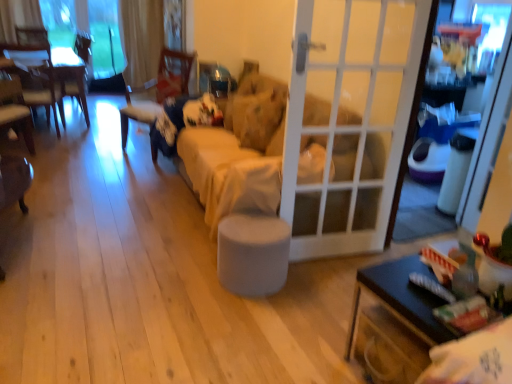
The image size is (512, 384). I want to click on free space in front of beige fabric couch at center, so click(172, 294).